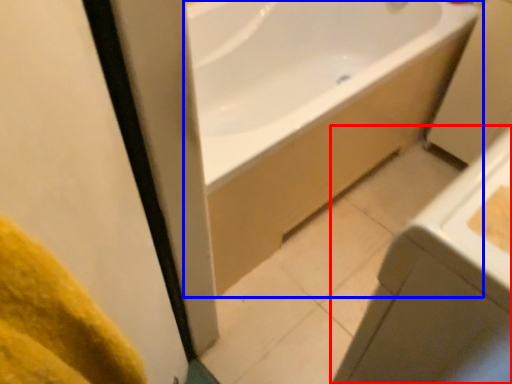
Question: Which point is closer to the camera, sink (highlighted by a red box) or bathtub (highlighted by a blue box)?

Choices:
 (A) sink
 (B) bathtub

Answer: (A)